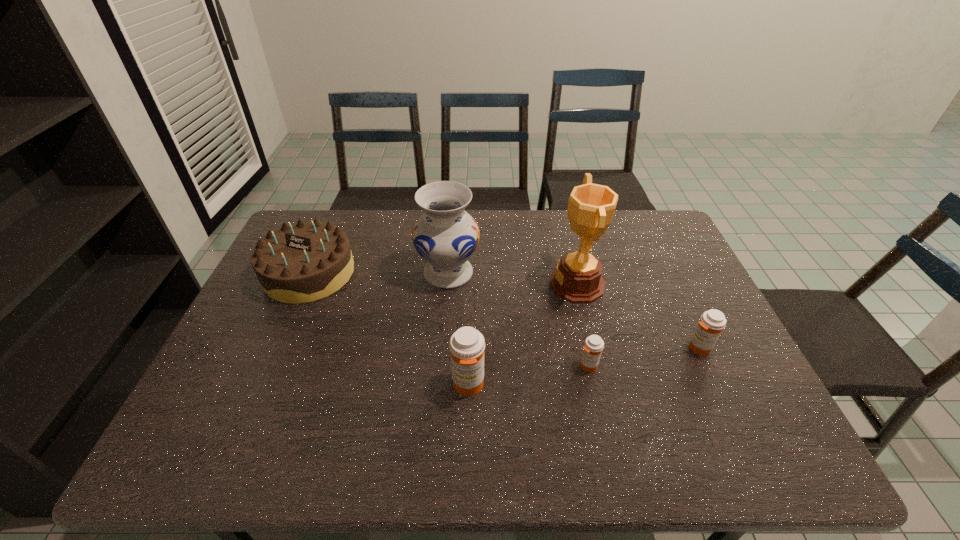
Please point a spot to add another medicine on the left. Please provide its 2D coordinates. Your answer should be formatted as a tuple, i.e. [(x, y)], where the tuple contains the x and y coordinates of a point satisfying the conditions above.

[(339, 406)]